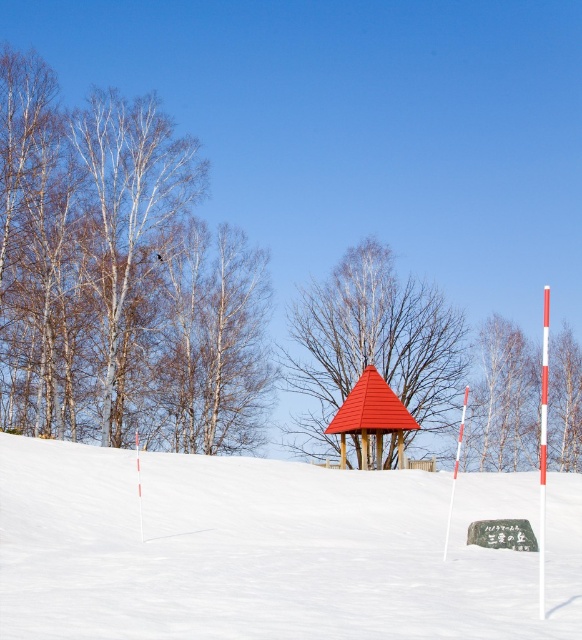
In the scene shown: Is smooth wooden gazebo at center shorter than bare birch tree at center?

In fact, smooth wooden gazebo at center may be taller than bare birch tree at center.

Does point (346, 252) come closer to viewer compared to point (551, 445)?

No.

This screenshot has height=640, width=582. I want to click on smooth wooden gazebo at center, so click(x=371, y=346).

Is white snow at center shorter than brown wood tree at center?

Yes, white snow at center is shorter than brown wood tree at center.

Can you confirm if white snow at center is thinner than brown wood tree at center?

No, white snow at center is not thinner than brown wood tree at center.

Find the location of `white snow at center`. white snow at center is located at coordinates 271,548.

Is white bark trees at left thinner than smooth wooden gazebo at center?

No.

Consider the image. Measure the distance between white bark trees at left and camera.

46.95 meters

At what (x,y) coordinates should I click in order to perform the action: click on white bark trees at left. Please return your answer as a coordinate pair (x, y). Image resolution: width=582 pixels, height=640 pixels. Looking at the image, I should click on (120, 280).